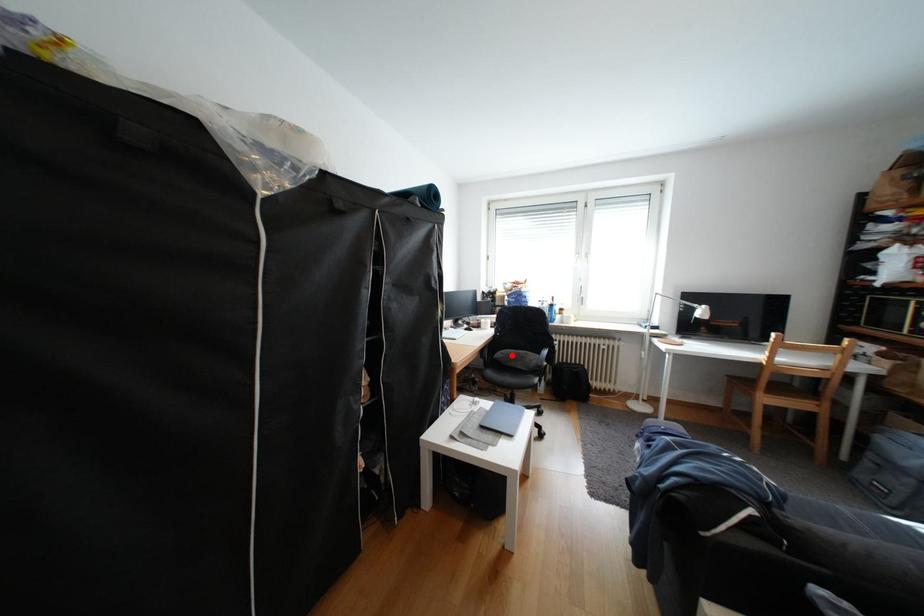
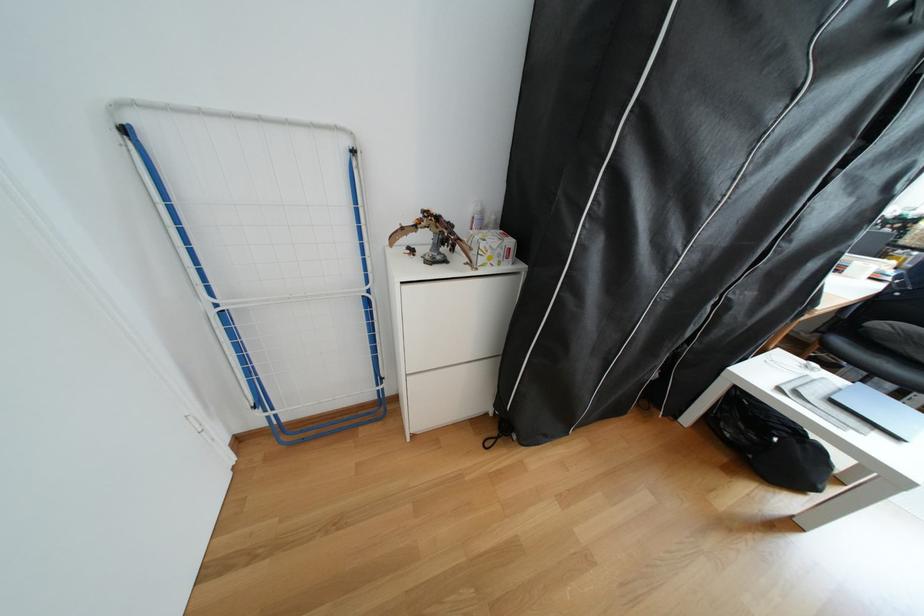
Where in the second image is the point corresponding to the highlighted location from the first image?

(894, 326)